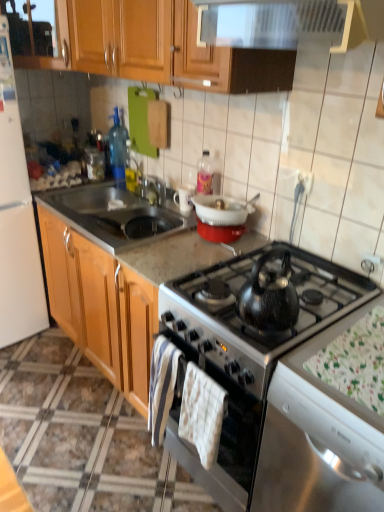
Question: From the image's perspective, is white matte refrigerator at left above or below white plastic bowl at upper center?

Choices:
 (A) below
 (B) above

Answer: (B)

Question: From a real-world perspective, is white matte refrigerator at left physically located above or below white plastic bowl at upper center?

Choices:
 (A) above
 (B) below

Answer: (B)

Question: Which object is positioned farthest from the white fabric placemat at lower right?

Choices:
 (A) white striped fabric at lower center, the 2th hand towel from the right
 (B) satin black kettle at center
 (C) marble gray countertop at center
 (D) satin silver sink at center
 (E) white cotton hand towel at center, which appears as the 2th hand towel when viewed from the left

Answer: (D)

Question: Which of these objects is positioned farthest from the shiny metallic kettle at center-right?

Choices:
 (A) marble gray countertop at center
 (B) metallic stainless steel exhaust hood at upper center
 (C) white fabric placemat at lower right
 (D) white cotton hand towel at center, which appears as the 2th hand towel when viewed from the left
 (E) white plastic bowl at upper center

Answer: (B)